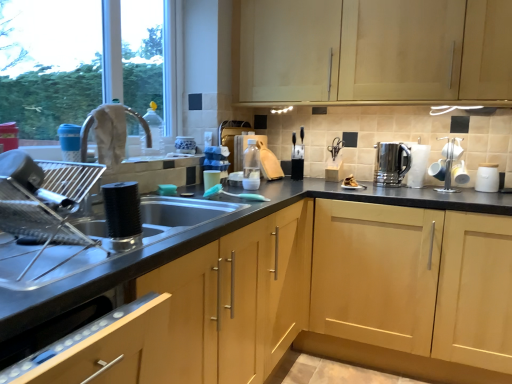
The image size is (512, 384). What are the coordinates of `free space to the right of matte plastic cup at sink, the first appliance from the front` in the screenshot? It's located at (233, 194).